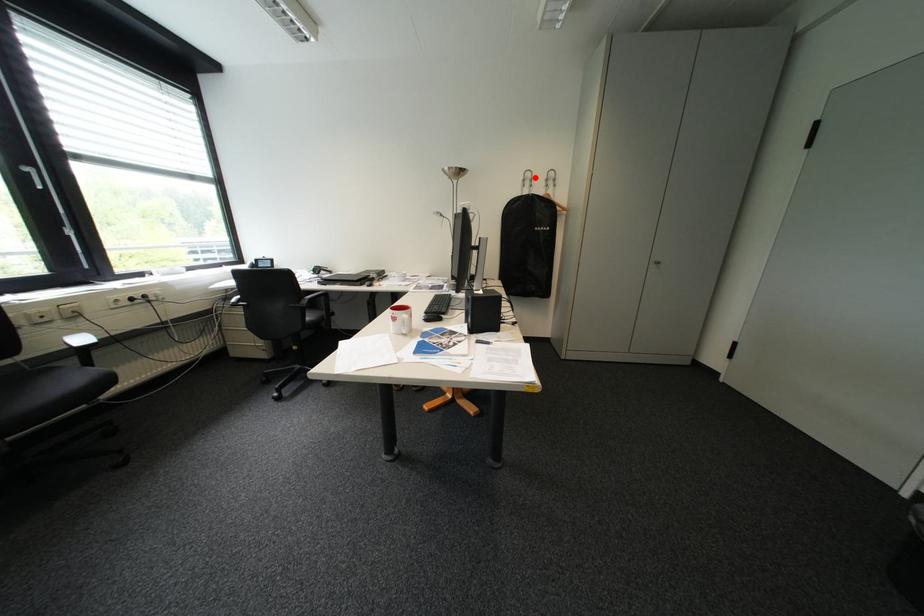
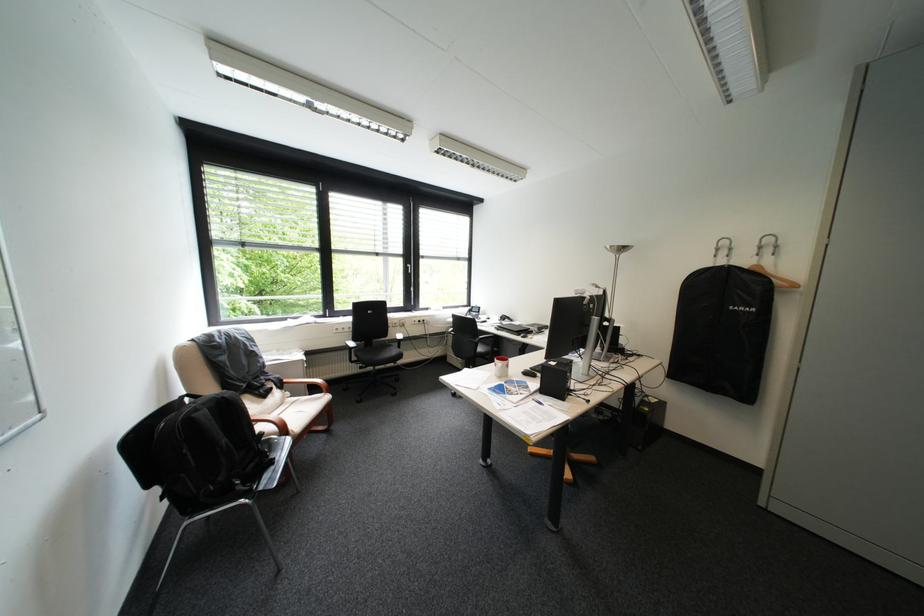
Locate, in the second image, the point that corresponds to the highlighted location in the first image.

(727, 246)